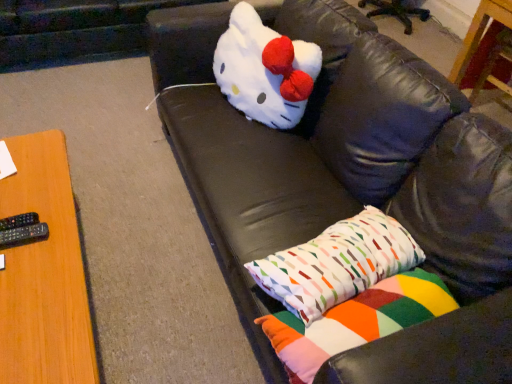
Question: From the image's perspective, is white plush toy at center above geometric-patterned fabric pillow at lower right, which is the 1th pillow in top-to-bottom order?

Choices:
 (A) no
 (B) yes

Answer: (B)

Question: Would you say white plush toy at center is outside geometric-patterned fabric pillow at lower right, which is the 1th pillow in top-to-bottom order?

Choices:
 (A) no
 (B) yes

Answer: (B)

Question: Is white plush toy at center at the left side of geometric-patterned fabric pillow at lower right, placed as the 2th pillow when sorted from bottom to top?

Choices:
 (A) no
 (B) yes

Answer: (B)

Question: From a real-world perspective, is white plush toy at center under geometric-patterned fabric pillow at lower right, which is the 1th pillow in top-to-bottom order?

Choices:
 (A) yes
 (B) no

Answer: (B)

Question: Can you confirm if white plush toy at center is shorter than geometric-patterned fabric pillow at lower right, which is the 1th pillow in top-to-bottom order?

Choices:
 (A) yes
 (B) no

Answer: (B)

Question: Is the position of white plush toy at center more distant than that of geometric-patterned fabric pillow at lower right, which is the 1th pillow in top-to-bottom order?

Choices:
 (A) no
 (B) yes

Answer: (B)

Question: Is black plastic remote at left, placed as the 1th remote when sorted from bottom to top, at the left side of wooden table at upper right, which is the first table in top-to-bottom order?

Choices:
 (A) no
 (B) yes

Answer: (B)

Question: From the image's perspective, is black plastic remote at left, the 2th remote positioned from the top, beneath wooden table at upper right, which appears as the first table when viewed from the back?

Choices:
 (A) yes
 (B) no

Answer: (A)

Question: Is black plastic remote at left, the 2th remote positioned from the top, at the right side of wooden table at upper right, which appears as the second table when ordered from the bottom?

Choices:
 (A) no
 (B) yes

Answer: (A)

Question: From a real-world perspective, is black plastic remote at left, the 2th remote positioned from the top, located higher than wooden table at upper right, which appears as the second table when viewed from the front?

Choices:
 (A) yes
 (B) no

Answer: (A)

Question: Is black plastic remote at left, the 2th remote positioned from the top, taller than wooden table at upper right, acting as the first table starting from the right?

Choices:
 (A) yes
 (B) no

Answer: (B)

Question: Can you confirm if black plastic remote at left, the 2th remote positioned from the top, is thinner than wooden table at upper right, which appears as the second table when viewed from the front?

Choices:
 (A) no
 (B) yes

Answer: (B)

Question: Considering the relative positions of wooden table at left, marked as the 2th table in a back-to-front arrangement, and black plastic remote at left, placed as the 1th remote when sorted from bottom to top, in the image provided, is wooden table at left, marked as the 2th table in a back-to-front arrangement, to the right of black plastic remote at left, placed as the 1th remote when sorted from bottom to top, from the viewer's perspective?

Choices:
 (A) no
 (B) yes

Answer: (A)